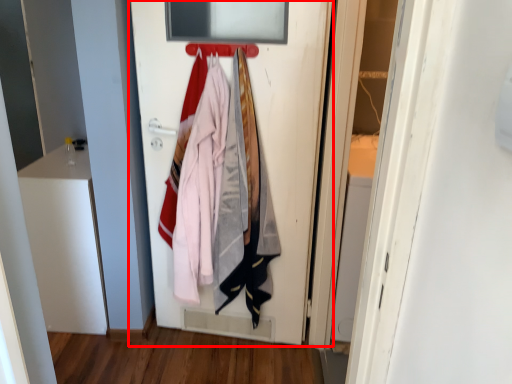
Question: Observing the image, what is the correct spatial positioning of door (annotated by the red box) in reference to hanger?

Choices:
 (A) right
 (B) left

Answer: (A)